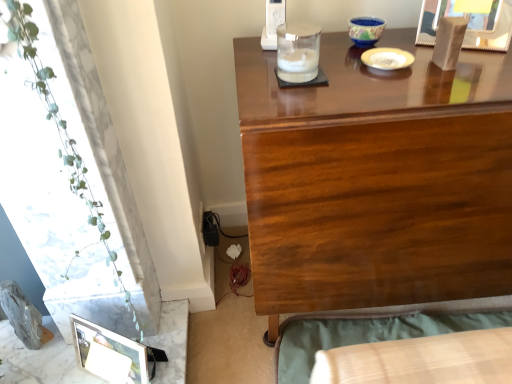
At what (x,y) coordinates should I click in order to perform the action: click on vacant space behind white glossy plate at upper center. Please return your answer as a coordinate pair (x, y). The image size is (512, 384). Looking at the image, I should click on (381, 35).